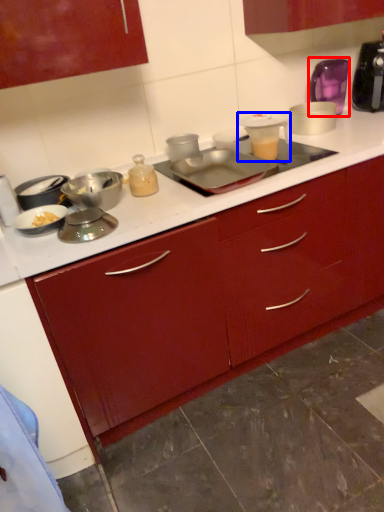
Question: Among these objects, which one is farthest to the camera, appliance (highlighted by a red box) or appliance (highlighted by a blue box)?

Choices:
 (A) appliance
 (B) appliance

Answer: (A)